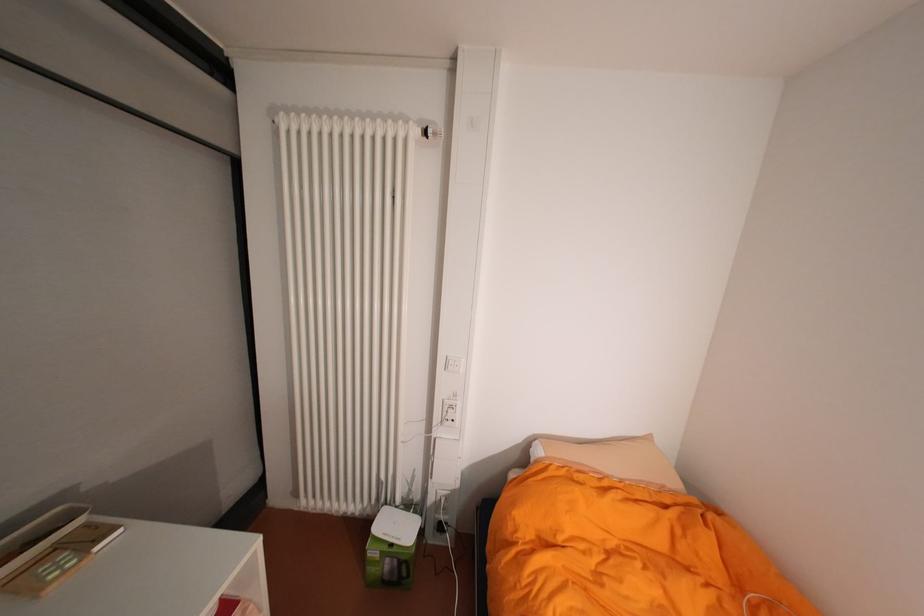
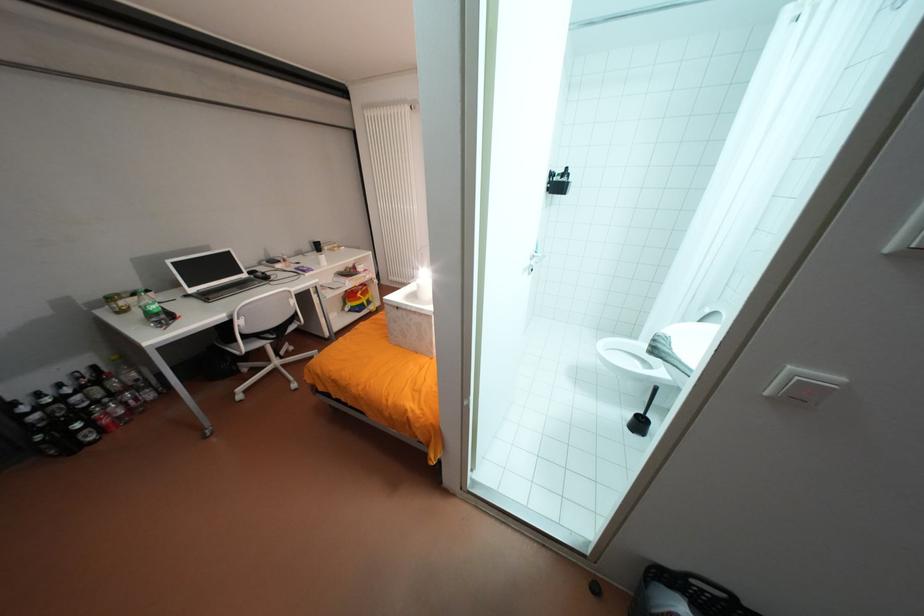
Which direction would the cameraman need to move to produce the second image?

The cameraman walked toward right, backward.